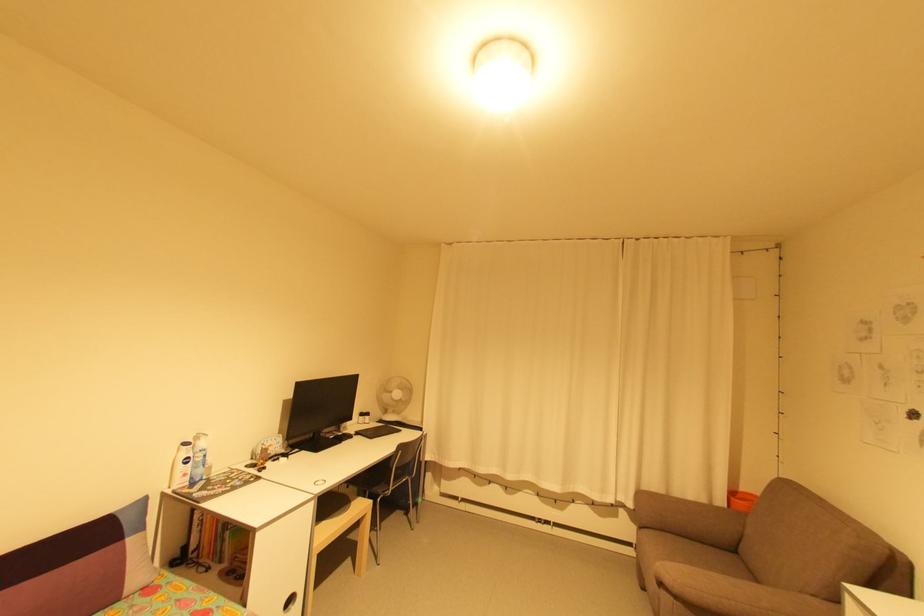
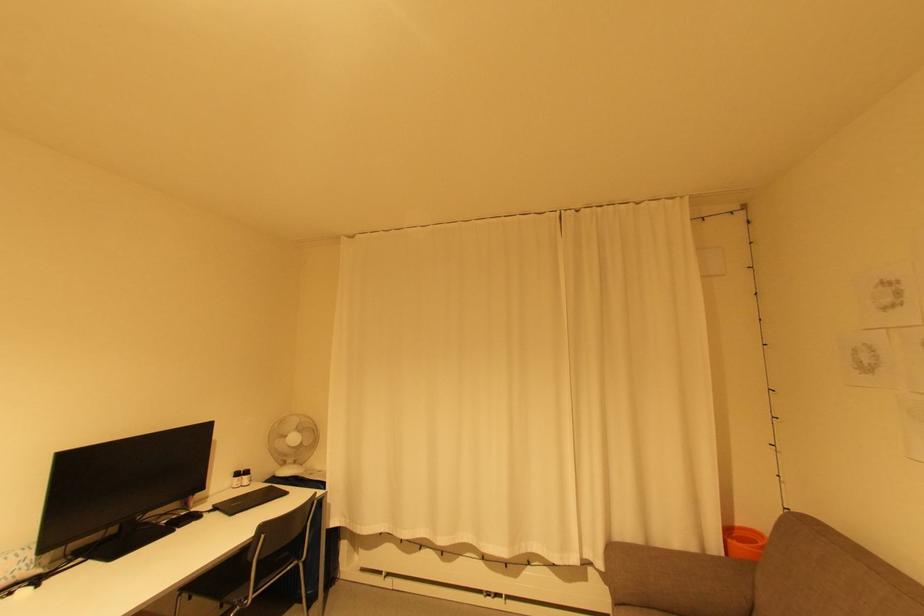
Locate, in the second image, the point that corresponds to point 400,469 in the first image.

(262, 562)